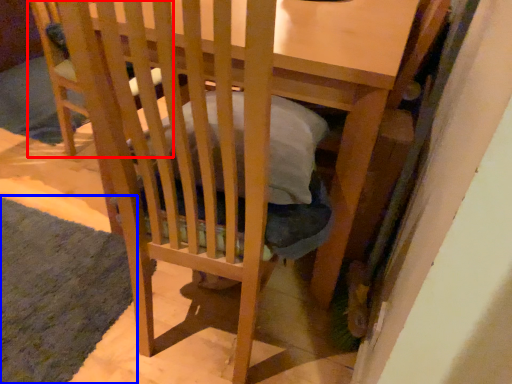
Question: Which object appears closest to the camera in this image, folding chair (highlighted by a red box) or mat (highlighted by a blue box)?

Choices:
 (A) folding chair
 (B) mat

Answer: (B)